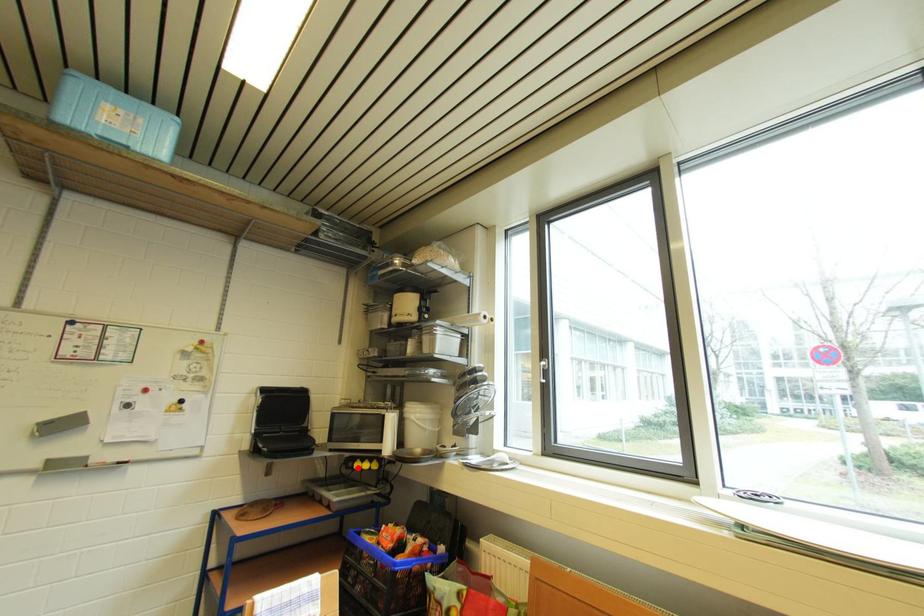
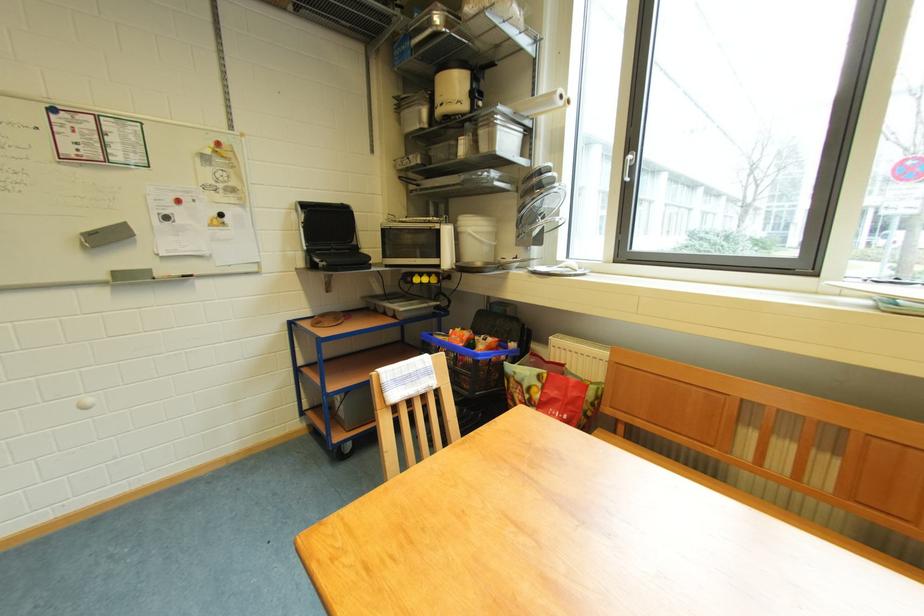
Question: I am providing you with two images of the same scene from different viewpoints. In image1, a red point is highlighted. Considering the same 3D point in image2, which of the following is correct?

Choices:
 (A) It is closer
 (B) It is farther

Answer: (A)